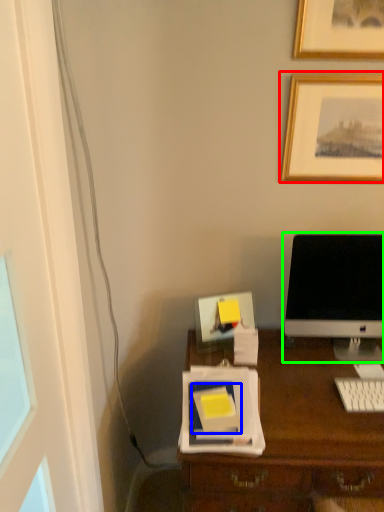
Question: Estimate the real-world distances between objects in this image. Which object is farther from picture frame (highlighted by a red box), notebook (highlighted by a blue box) or computer monitor (highlighted by a green box)?

Choices:
 (A) notebook
 (B) computer monitor

Answer: (A)